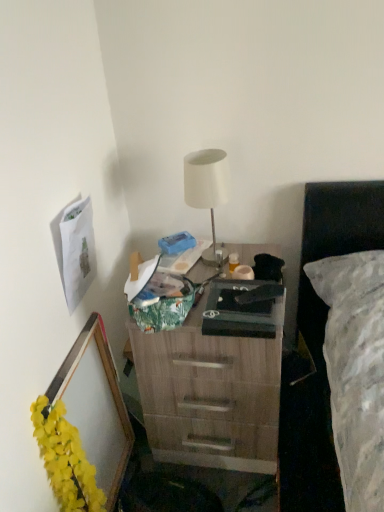
Question: Considering the relative sizes of wooden picture frame at lower left and white matte lamp at center in the image provided, is wooden picture frame at lower left bigger than white matte lamp at center?

Choices:
 (A) yes
 (B) no

Answer: (A)

Question: Is wooden picture frame at lower left in contact with white matte lamp at center?

Choices:
 (A) no
 (B) yes

Answer: (A)

Question: Considering the relative sizes of wooden picture frame at lower left and white matte lamp at center in the image provided, is wooden picture frame at lower left smaller than white matte lamp at center?

Choices:
 (A) no
 (B) yes

Answer: (A)

Question: Considering the relative sizes of wooden picture frame at lower left and white matte lamp at center in the image provided, is wooden picture frame at lower left wider than white matte lamp at center?

Choices:
 (A) yes
 (B) no

Answer: (B)

Question: Is wooden picture frame at lower left facing towards white matte lamp at center?

Choices:
 (A) no
 (B) yes

Answer: (A)

Question: Is wooden desk at center taller or shorter than yellow fabric garland at lower left?

Choices:
 (A) tall
 (B) short

Answer: (A)

Question: In terms of size, does wooden desk at center appear bigger or smaller than yellow fabric garland at lower left?

Choices:
 (A) small
 (B) big

Answer: (B)

Question: Considering the positions of wooden desk at center and yellow fabric garland at lower left in the image, is wooden desk at center wider or thinner than yellow fabric garland at lower left?

Choices:
 (A) wide
 (B) thin

Answer: (A)

Question: From the image's perspective, is wooden desk at center located above or below yellow fabric garland at lower left?

Choices:
 (A) below
 (B) above

Answer: (B)

Question: Is matte black box at center in front of or behind wooden desk at center in the image?

Choices:
 (A) front
 (B) behind

Answer: (A)

Question: Which is correct: matte black box at center is inside wooden desk at center, or outside of it?

Choices:
 (A) inside
 (B) outside

Answer: (B)

Question: From their relative heights in the image, would you say matte black box at center is taller or shorter than wooden desk at center?

Choices:
 (A) short
 (B) tall

Answer: (A)

Question: Considering the positions of point (228, 296) and point (178, 347), is point (228, 296) closer or farther from the camera than point (178, 347)?

Choices:
 (A) closer
 (B) farther

Answer: (A)

Question: Based on their positions, is white matte lamp at center located to the left or right of wooden picture frame at lower left?

Choices:
 (A) right
 (B) left

Answer: (A)

Question: Considering the positions of point (210, 258) and point (115, 382), is point (210, 258) closer or farther from the camera than point (115, 382)?

Choices:
 (A) closer
 (B) farther

Answer: (A)